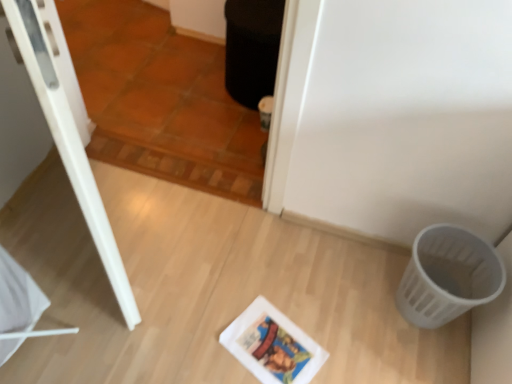
I want to click on free space that is to the left of matte white comic book at center, so click(203, 336).